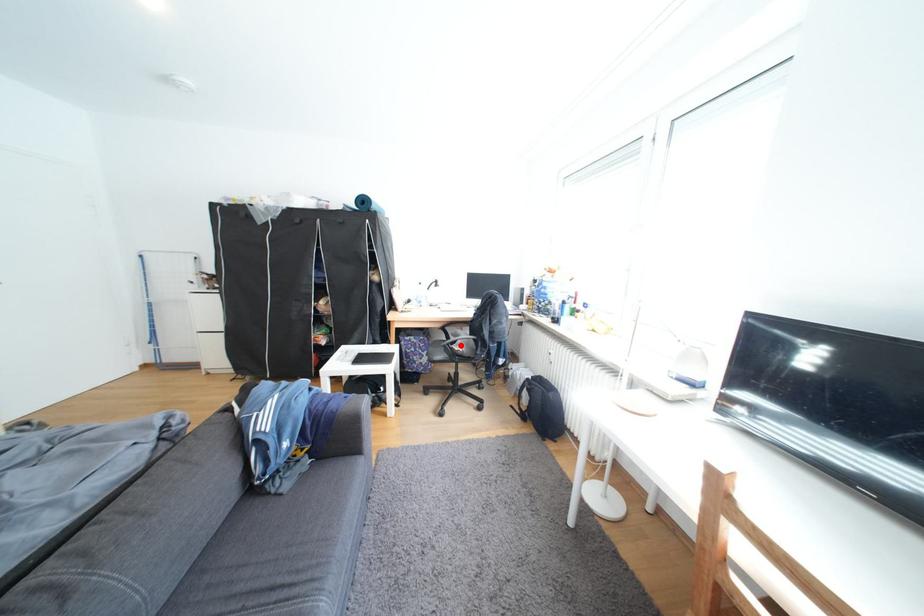
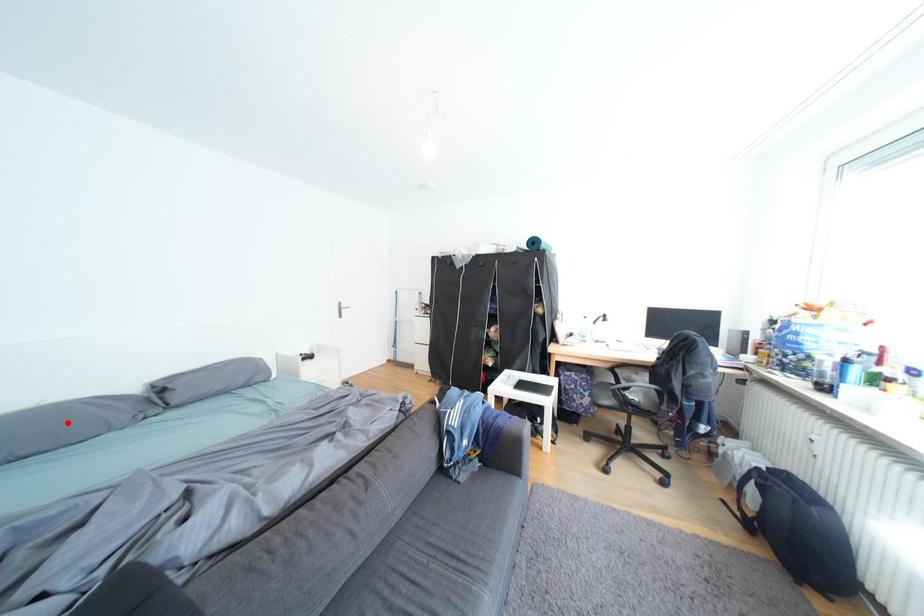
I am providing you with two images of the same scene from different viewpoints. A red point is marked on the first image and another point is marked on the second image. Does the point marked in image1 correspond to the same location as the one in image2?

No